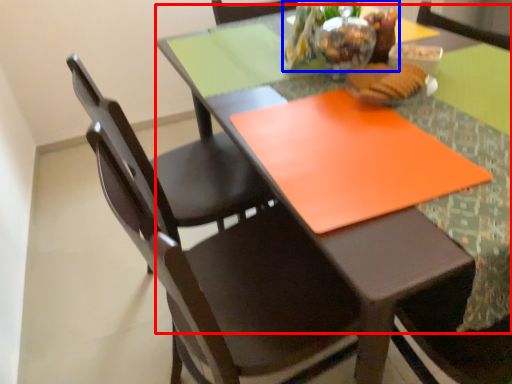
Question: Which of the following is the farthest to the observer, round table (highlighted by a red box) or floral arrangement (highlighted by a blue box)?

Choices:
 (A) round table
 (B) floral arrangement

Answer: (B)